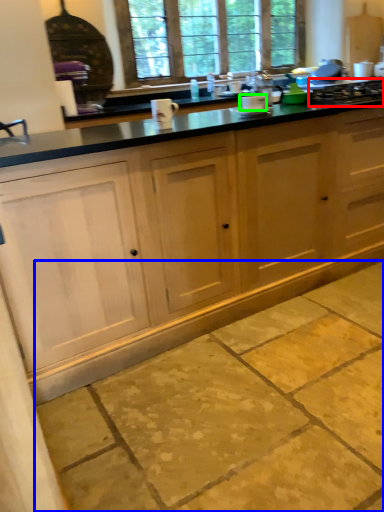
Question: Which object is positioned farthest from gas stove (highlighted by a red box)? Select from concrete (highlighted by a blue box) and appliance (highlighted by a green box).

Choices:
 (A) concrete
 (B) appliance

Answer: (A)